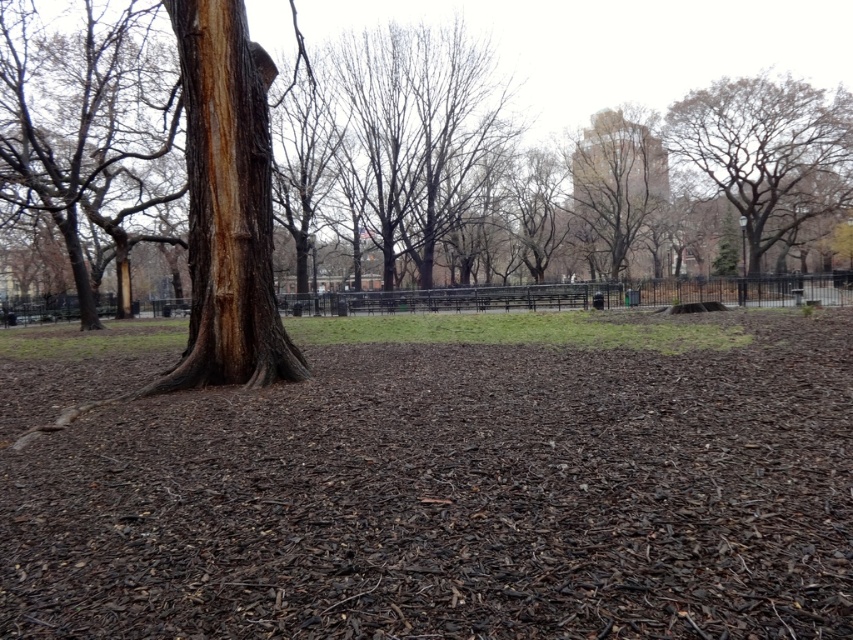
Question: Which object is the closest to the brown rough bark tree at upper center?

Choices:
 (A) brown mulch at center
 (B) brown rough bark tree at left
 (C) rough bark tree at center

Answer: (C)

Question: Can you confirm if brown rough bark tree trunk at left is bigger than brown rough bark tree at upper right?

Choices:
 (A) yes
 (B) no

Answer: (B)

Question: Does rough bark tree at center have a smaller size compared to brown rough bark tree at left?

Choices:
 (A) yes
 (B) no

Answer: (B)

Question: Observing the image, what is the correct spatial positioning of brown rough bark tree at left in reference to brown rough bark tree at upper center?

Choices:
 (A) above
 (B) below

Answer: (B)

Question: Which point is farther to the camera?

Choices:
 (A) brown rough bark tree trunk at left
 (B) brown rough bark tree at left
 (C) brown mulch at center

Answer: (B)

Question: Based on their relative distances, which object is farther from the brown rough bark tree trunk at left?

Choices:
 (A) brown rough bark tree at left
 (B) rough bark tree at center
 (C) brown rough bark tree at upper center

Answer: (C)